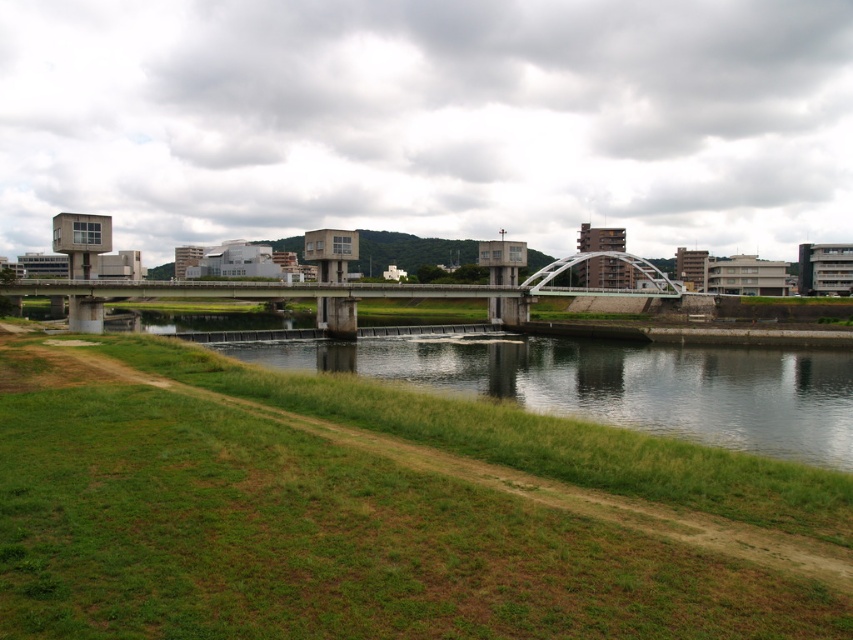
Does green grassy bank at lower left appear over concrete bridge at center?

Actually, green grassy bank at lower left is below concrete bridge at center.

Is point (734, 378) less distant than point (277, 305)?

Yes, point (734, 378) is closer to viewer.

I want to click on green grassy bank at lower left, so click(x=616, y=385).